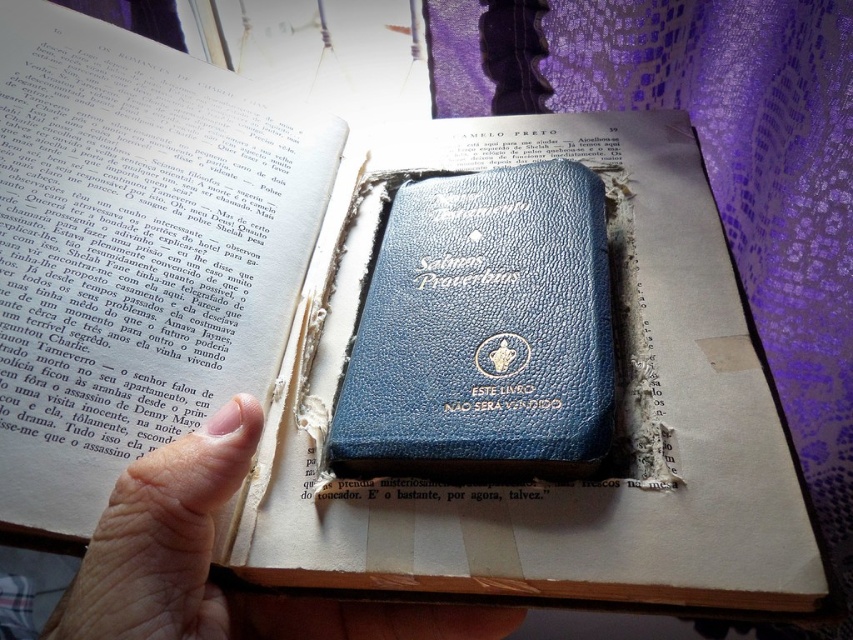
What object is located at the coordinates point (483,332) in the image?

The blue leather book at center is located at point (483,332).

What are the coordinates of the blue leather book at center in the image?

The blue leather book at center is located at coordinates point (483, 332).